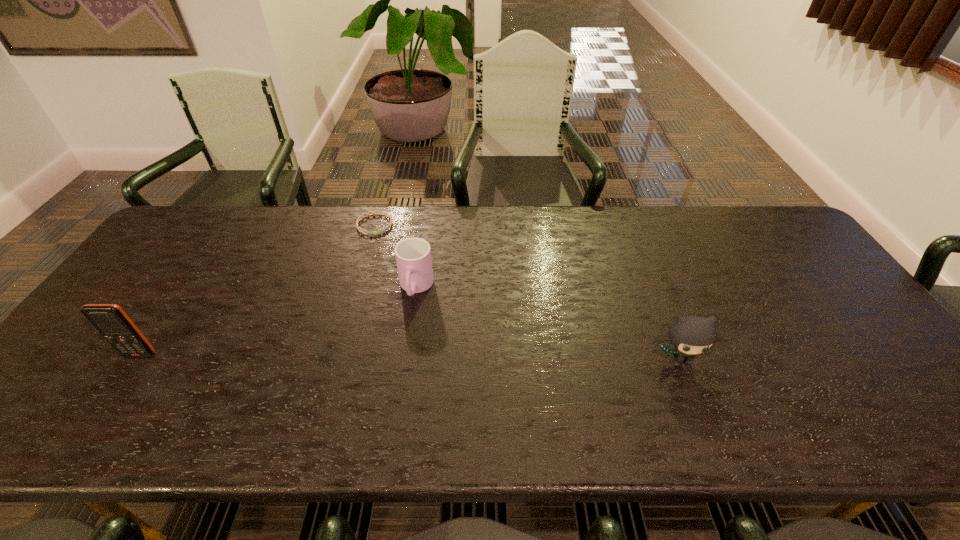
Locate an element on the screen. The image size is (960, 540). free spot at the left edge of the desktop is located at coordinates (114, 304).

Where is `vacant space at the far right corner`? Image resolution: width=960 pixels, height=540 pixels. vacant space at the far right corner is located at coordinates (748, 235).

I want to click on vacant space in between the farthest object and the rightmost object, so click(x=527, y=292).

This screenshot has height=540, width=960. I want to click on free space between the farthest object and the tallest object, so click(257, 289).

What are the coordinates of `empty space between the leftmost object and the second shortest object` in the screenshot? It's located at (278, 321).

Find the location of a particular element. Image resolution: width=960 pixels, height=540 pixels. vacant area that lies between the rightmost object and the cellular telephone is located at coordinates (410, 357).

The width and height of the screenshot is (960, 540). Identify the location of empty space between the farthest object and the rightmost object. (527, 292).

The height and width of the screenshot is (540, 960). What are the coordinates of `vacant space that is in between the tallest object and the second shortest object` in the screenshot? It's located at (278, 321).

Find the location of a particular element. free point between the third object from right to left and the rightmost object is located at coordinates (527, 292).

Locate an element on the screen. The height and width of the screenshot is (540, 960). empty space between the third object from left to right and the leftmost object is located at coordinates (278, 321).